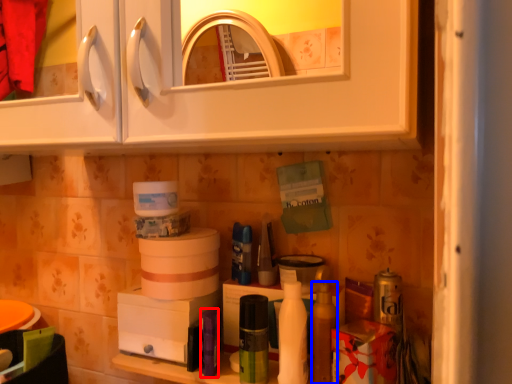
Question: Which point is further to the camera, toiletry (highlighted by a red box) or toiletry (highlighted by a blue box)?

Choices:
 (A) toiletry
 (B) toiletry

Answer: (A)